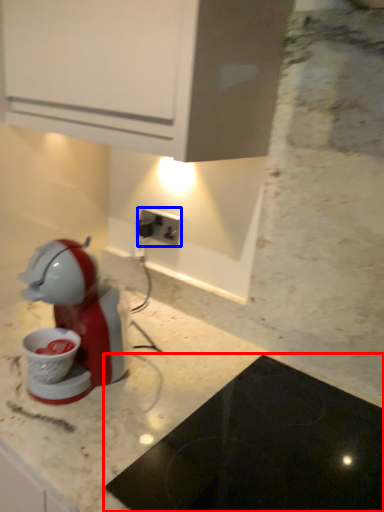
Question: Which point is further to the camera, home appliance (highlighted by a red box) or power plugs and sockets (highlighted by a blue box)?

Choices:
 (A) home appliance
 (B) power plugs and sockets

Answer: (B)